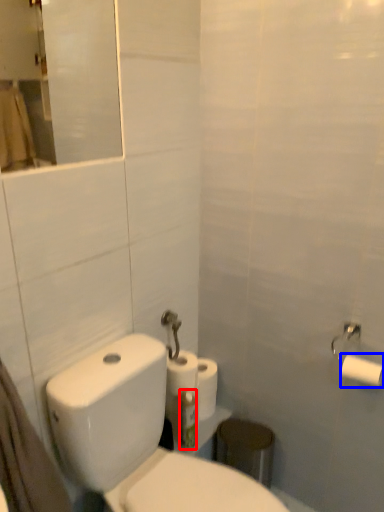
Question: Which object appears farthest to the camera in this image, toothbrush (highlighted by a red box) or toilet paper (highlighted by a blue box)?

Choices:
 (A) toothbrush
 (B) toilet paper

Answer: (A)